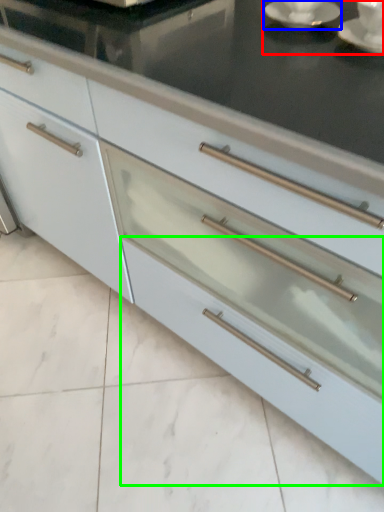
Question: Considering the real-world distances, which object is farthest from tea set (highlighted by a red box)? saucer (highlighted by a blue box) or drawer (highlighted by a green box)?

Choices:
 (A) saucer
 (B) drawer

Answer: (B)